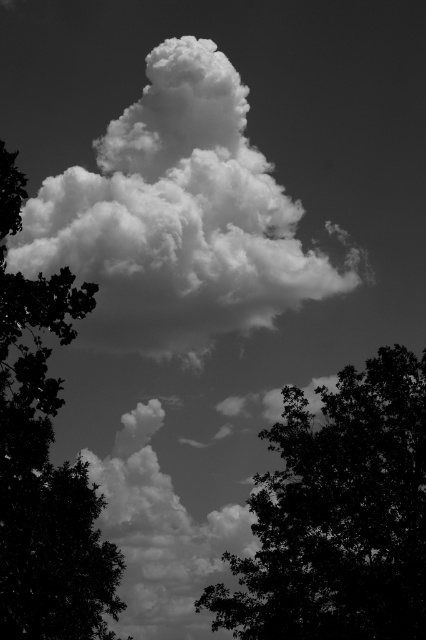
Does white fluffy cloud at center have a greater width compared to silhouette leafy tree at center?

Yes, white fluffy cloud at center is wider than silhouette leafy tree at center.

Is the position of white fluffy cloud at center less distant than that of silhouette leafy tree at center?

No.

Does point (138, 243) lie behind point (379, 404)?

Yes, point (138, 243) is behind point (379, 404).

Identify the location of white fluffy cloud at center. (175, 218).

Is silhouette leafy tree at center closer to the viewer compared to silhouette leafy tree at left?

No, it is not.

Can you confirm if silhouette leafy tree at center is positioned below silhouette leafy tree at left?

Yes, silhouette leafy tree at center is below silhouette leafy tree at left.

Does point (380, 464) come closer to viewer compared to point (45, 636)?

No, (380, 464) is further to viewer.

This screenshot has height=640, width=426. What are the coordinates of `silhouette leafy tree at center` in the screenshot? It's located at (339, 515).

Between white fluffy cloud at center and silhouette leafy tree at left, which one is positioned higher?

Positioned higher is white fluffy cloud at center.

What do you see at coordinates (175, 218) in the screenshot?
I see `white fluffy cloud at center` at bounding box center [175, 218].

Identify the location of white fluffy cloud at center. (175, 218).